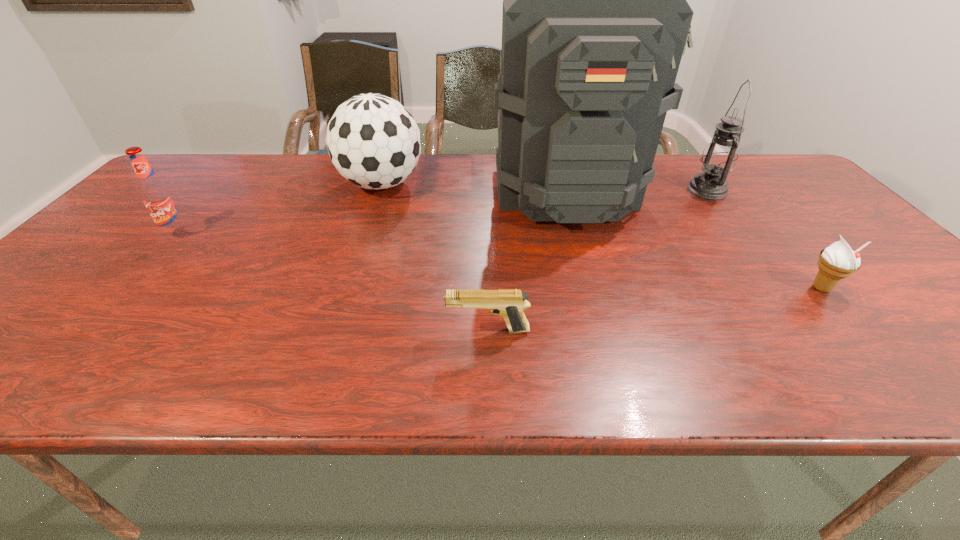
Identify the location of the tallest object. (x=595, y=21).

Locate an element on the screen. oil lamp is located at coordinates (719, 157).

Identify the location of soccer ball. The image size is (960, 540). (373, 141).

Locate an element on the screen. The width and height of the screenshot is (960, 540). the leftmost object is located at coordinates (158, 198).

Where is `the fifth farthest object`? Image resolution: width=960 pixels, height=540 pixels. the fifth farthest object is located at coordinates (838, 261).

Identify the location of icecream. (838, 261).

You are a GUI agent. You are given a task and a screenshot of the screen. Output one action in this format:
    pyautogui.click(x=<x>, y=<y>)
    Task: Click on the nearest object
    This screenshot has height=540, width=960.
    Given the screenshot: What is the action you would take?
    pyautogui.click(x=508, y=303)

Where is `pistol`? This screenshot has height=540, width=960. pistol is located at coordinates (508, 303).

You are a GUI agent. You are given a task and a screenshot of the screen. Output one action in this format:
    pyautogui.click(x=<x>, y=<y>)
    Task: Click on the vacant space located 0.360m on the front compartment of the backpack
    Image resolution: width=960 pixels, height=540 pixels.
    Given the screenshot: What is the action you would take?
    pyautogui.click(x=609, y=345)

You are a GUI agent. You are given a task and a screenshot of the screen. Output one action in this format:
    pyautogui.click(x=<x>, y=<y>)
    Task: Click on the free space located on the left of the fifth shortest object
    This screenshot has width=960, height=540.
    Given the screenshot: What is the action you would take?
    pyautogui.click(x=665, y=190)